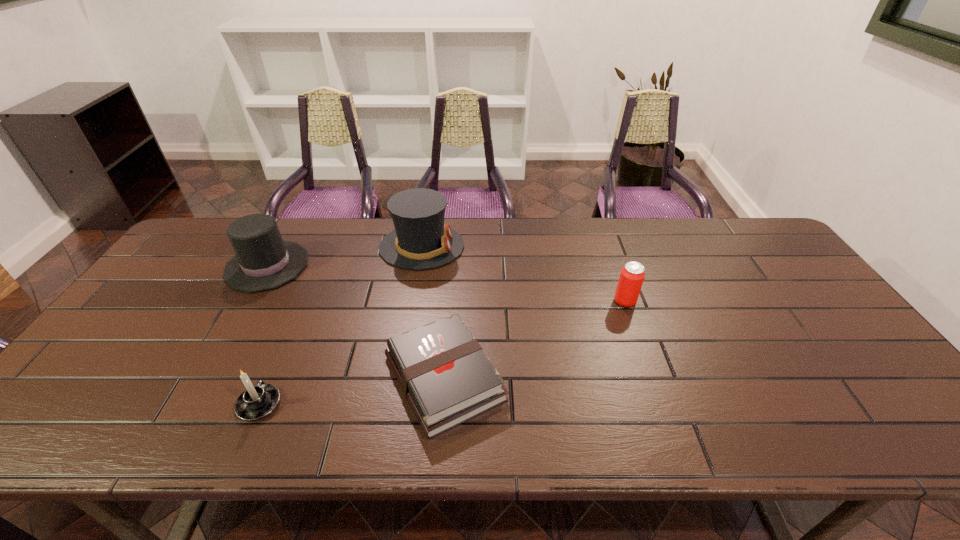
Identify the location of vacant area at the far right corner of the desktop. Image resolution: width=960 pixels, height=540 pixels. (721, 234).

The image size is (960, 540). What are the coordinates of `free space between the right dress hat and the candle holder` in the screenshot? It's located at (341, 326).

Where is `free spot between the beer can and the left dress hat`? free spot between the beer can and the left dress hat is located at coordinates (446, 284).

I want to click on empty space between the candle holder and the right dress hat, so click(x=341, y=326).

I want to click on empty location between the candle holder and the right dress hat, so click(341, 326).

The width and height of the screenshot is (960, 540). I want to click on free area in between the candle holder and the right dress hat, so click(x=341, y=326).

Identify the location of free area in between the left dress hat and the beer can. (446, 284).

Where is `free space between the shortest object and the left dress hat`? The height and width of the screenshot is (540, 960). free space between the shortest object and the left dress hat is located at coordinates (356, 322).

The image size is (960, 540). Find the location of `vacant region between the shortest object and the right dress hat`. vacant region between the shortest object and the right dress hat is located at coordinates (433, 312).

I want to click on free point between the right dress hat and the third farthest object, so click(523, 274).